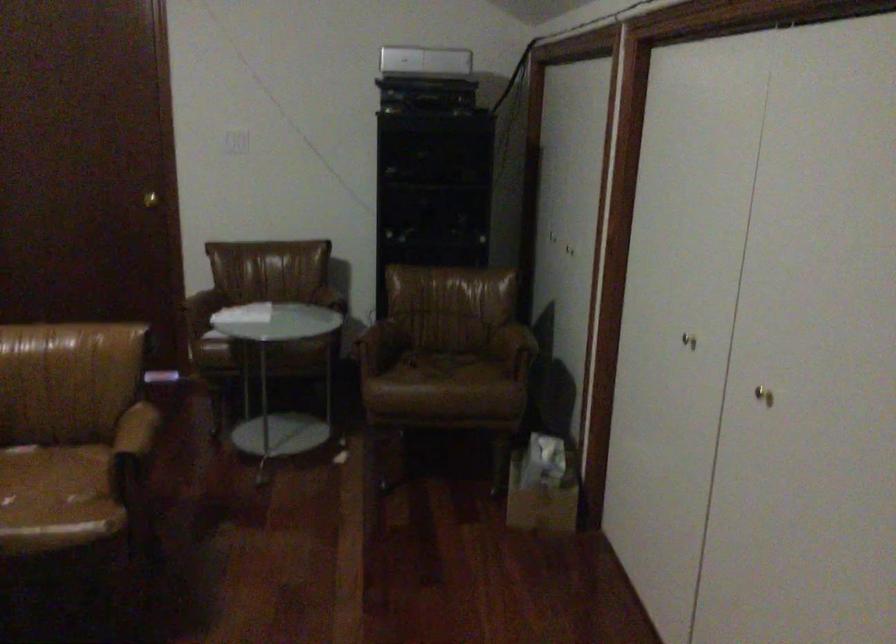
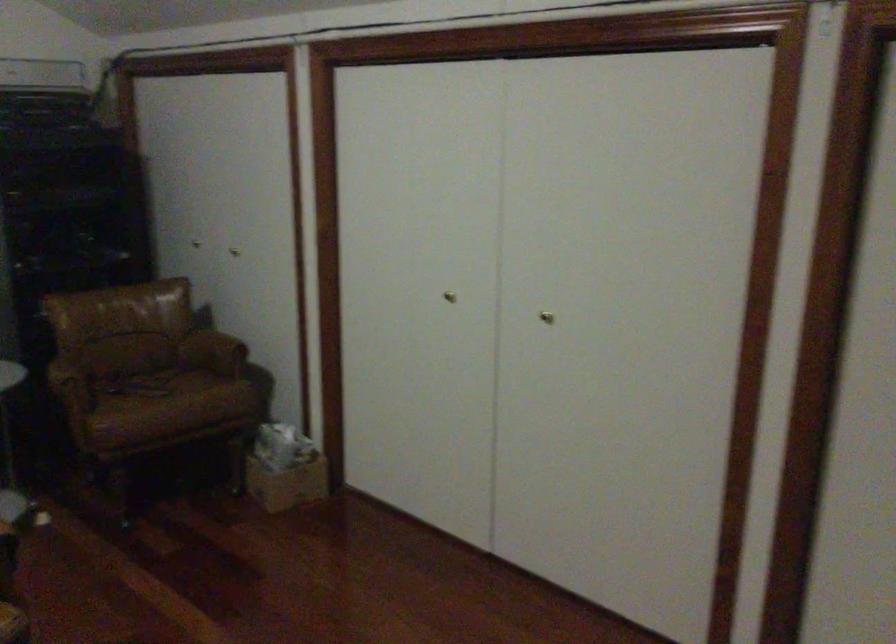
Find the pixel in the second image that matches point 690,333 in the first image.

(449, 297)